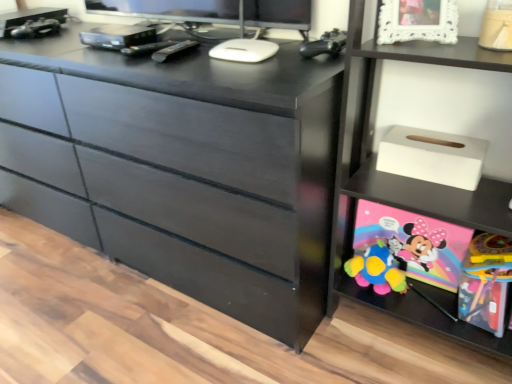
Question: Is black plastic remote at center in front of white matte tissue box at upper right?

Choices:
 (A) no
 (B) yes

Answer: (A)

Question: Would you consider black plastic remote at center to be distant from white matte tissue box at upper right?

Choices:
 (A) yes
 (B) no

Answer: (B)

Question: Is black plastic remote at center thinner than white matte tissue box at upper right?

Choices:
 (A) yes
 (B) no

Answer: (B)

Question: From a real-world perspective, is black plastic remote at center physically below white matte tissue box at upper right?

Choices:
 (A) no
 (B) yes

Answer: (A)

Question: Is black plastic remote at center facing away from white matte tissue box at upper right?

Choices:
 (A) yes
 (B) no

Answer: (B)

Question: Is point (324, 38) closer or farther from the camera than point (436, 19)?

Choices:
 (A) closer
 (B) farther

Answer: (B)

Question: In the image, is black matte controller at upper right, placed as the 2th toy when sorted from right to left, positioned in front of or behind white lace picture frame at upper right?

Choices:
 (A) front
 (B) behind

Answer: (B)

Question: Considering the positions of black matte controller at upper right, placed as the 2th toy when sorted from right to left, and white lace picture frame at upper right in the image, is black matte controller at upper right, placed as the 2th toy when sorted from right to left, taller or shorter than white lace picture frame at upper right?

Choices:
 (A) tall
 (B) short

Answer: (B)

Question: Is black matte controller at upper right, placed as the 2th toy when sorted from right to left, inside the boundaries of white lace picture frame at upper right, or outside?

Choices:
 (A) outside
 (B) inside

Answer: (A)

Question: Is point (9, 122) positioned closer to the camera than point (475, 155)?

Choices:
 (A) farther
 (B) closer

Answer: (A)

Question: Considering their positions, is matte black dresser at center located in front of or behind white matte tissue box at upper right?

Choices:
 (A) behind
 (B) front

Answer: (B)

Question: Is matte black dresser at center wider or thinner than white matte tissue box at upper right?

Choices:
 (A) wide
 (B) thin

Answer: (A)

Question: Based on their sizes in the image, would you say matte black dresser at center is bigger or smaller than white matte tissue box at upper right?

Choices:
 (A) small
 (B) big

Answer: (B)

Question: From a real-world perspective, is white lace picture frame at upper right physically located above or below rubberized plastic toy at lower right, the second toy in the left-to-right sequence?

Choices:
 (A) below
 (B) above

Answer: (B)

Question: Is point pos(442,29) positioned closer to the camera than point pos(475,281)?

Choices:
 (A) closer
 (B) farther

Answer: (A)